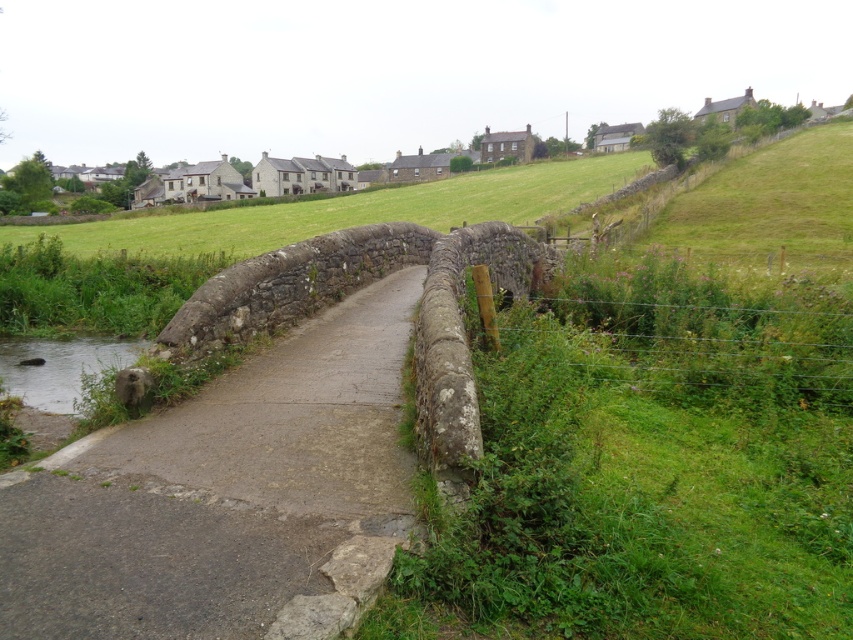
What do you see at coordinates (222, 492) in the screenshot? I see `gray concrete path at center` at bounding box center [222, 492].

What are the coordinates of `gray concrete path at center` in the screenshot? It's located at (222, 492).

Who is more distant from viewer, (138, 474) or (669, 282)?

Point (669, 282)

This screenshot has height=640, width=853. Identify the location of gray concrete path at center. (222, 492).

Looking at this image, who is more forward, (154, 611) or (74, 372)?

Point (154, 611)

Is point (146, 509) farther from viewer compared to point (16, 349)?

That is False.

Does point (183, 563) come closer to viewer compared to point (12, 369)?

Yes.

The height and width of the screenshot is (640, 853). Find the location of `gray concrete path at center`. gray concrete path at center is located at coordinates (222, 492).

Can you confirm if wire mesh fence at right is positioned above clear water at lower left?

Yes, wire mesh fence at right is above clear water at lower left.

From the picture: Is wire mesh fence at right positioned before clear water at lower left?

Yes, it is in front of clear water at lower left.

Where is `wire mesh fence at right`? wire mesh fence at right is located at coordinates (711, 332).